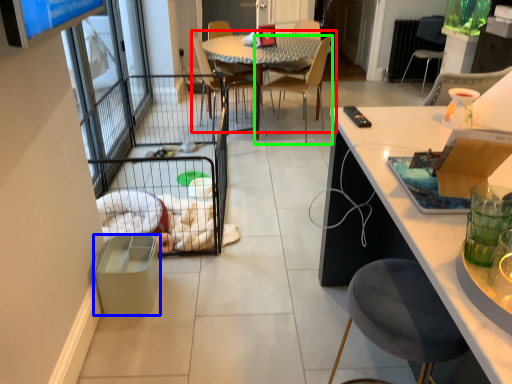
Question: Which object is positioned farthest from kitchen & dining room table (highlighted by a red box)? Select from trash bin/can (highlighted by a blue box) and chair (highlighted by a green box).

Choices:
 (A) trash bin/can
 (B) chair

Answer: (A)